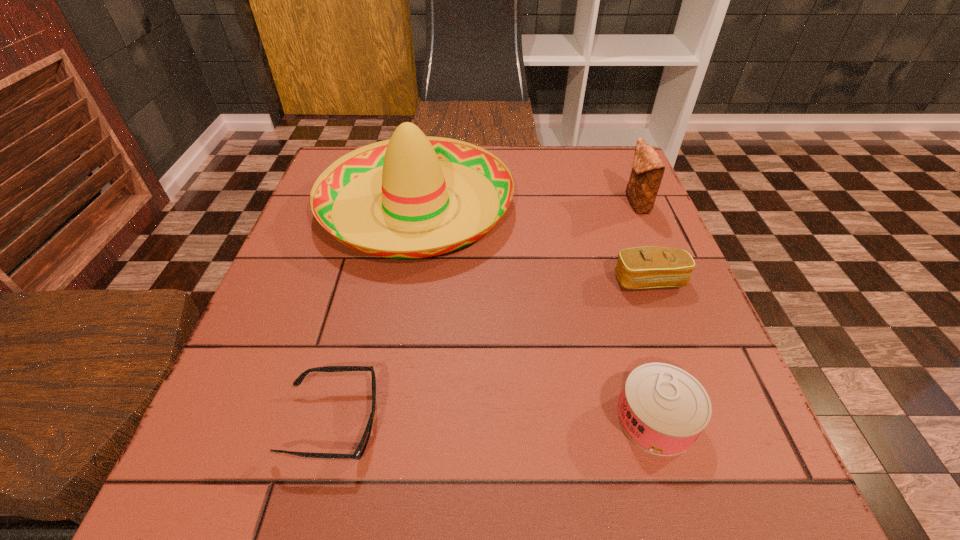
Identify the location of the second closest object relative to the shorter clutch bag. (414, 173).

Where is `vacant space that satisfies the following two spatial constraints: 1. on the open side of the taller clutch bag; 2. on the zipper side of the nearer clutch bag`? The height and width of the screenshot is (540, 960). vacant space that satisfies the following two spatial constraints: 1. on the open side of the taller clutch bag; 2. on the zipper side of the nearer clutch bag is located at coordinates (669, 281).

I want to click on vacant region that satisfies the following two spatial constraints: 1. on the open side of the taller clutch bag; 2. on the zipper side of the nearer clutch bag, so tap(669, 281).